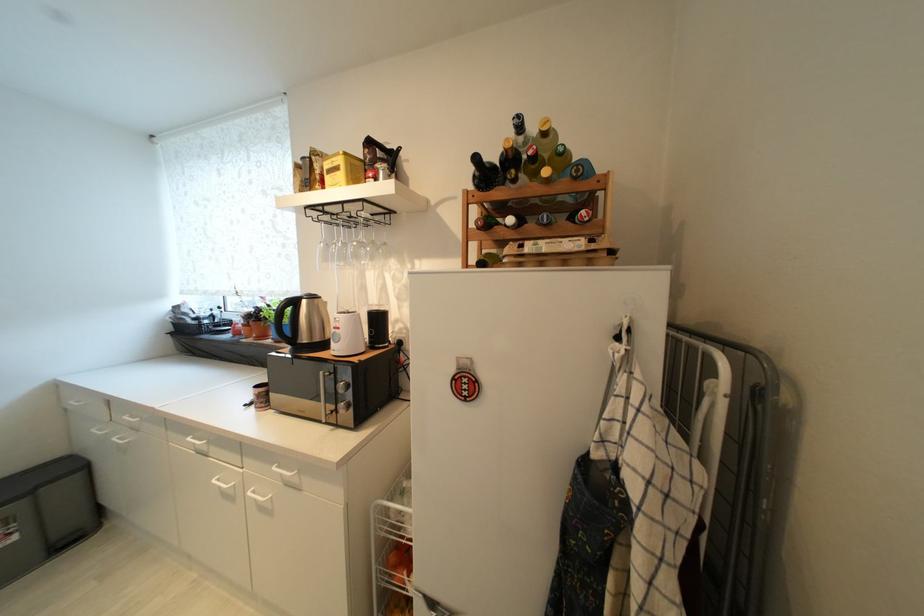
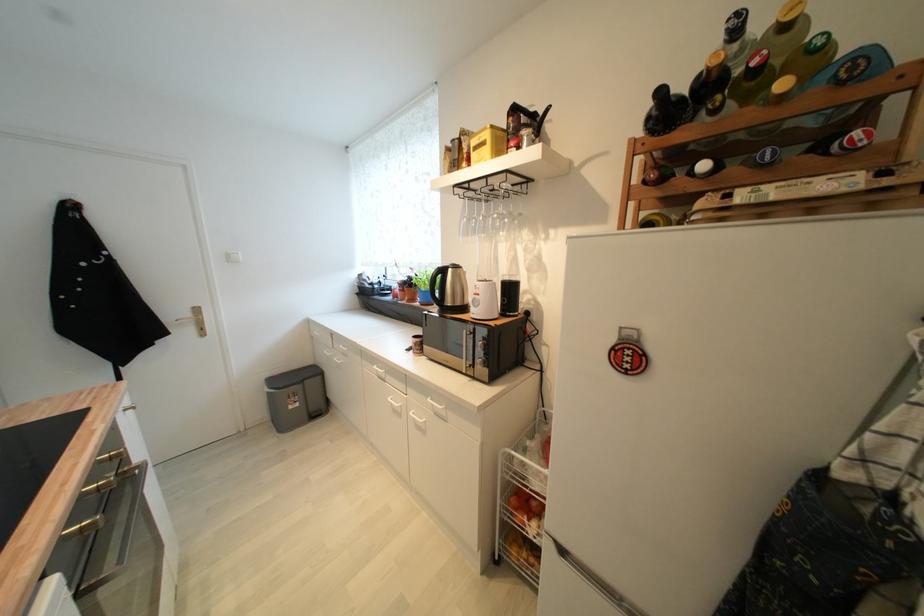
In the second image, find the point that corresponds to point (573, 220) in the first image.

(813, 153)